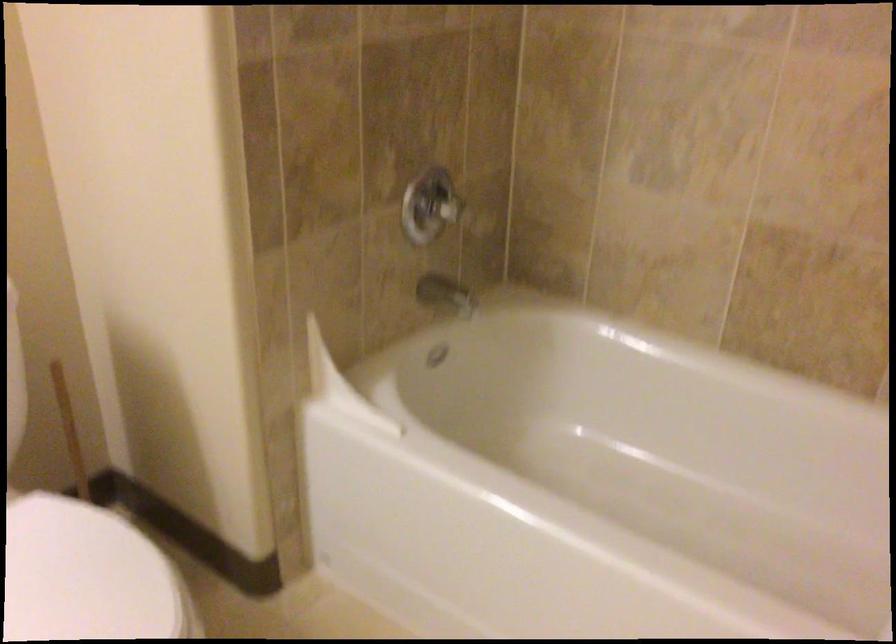
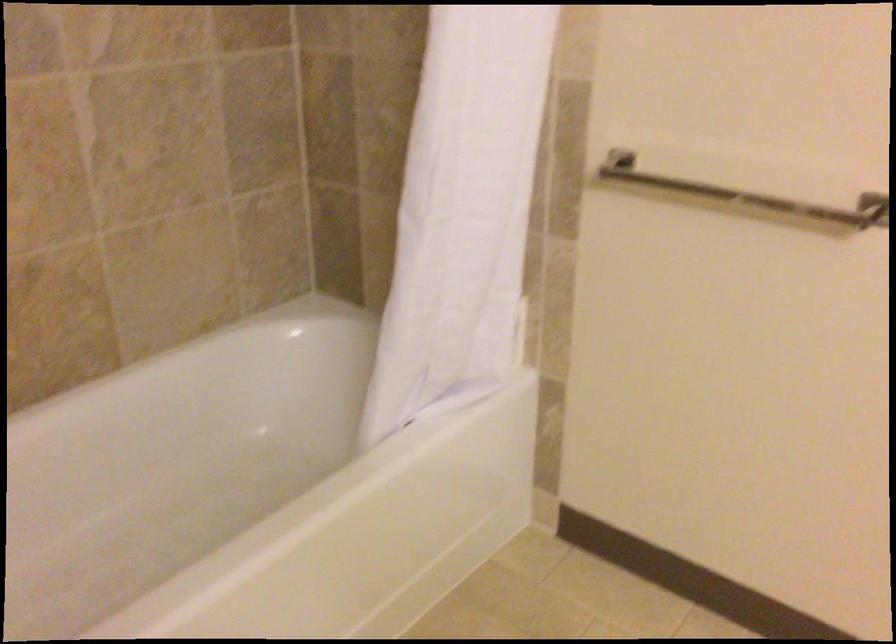
Looking at this image, first-person continuous shooting, in which direction is the camera rotating?

The rotation direction of the camera is right-down.